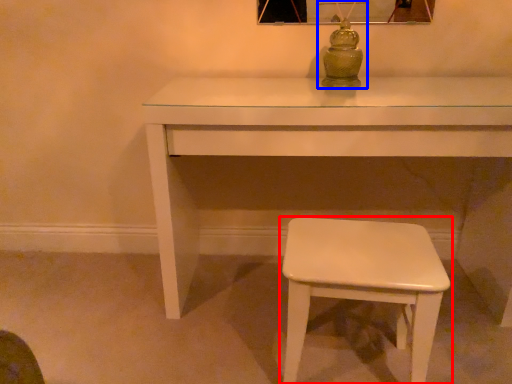
Question: Which object appears farthest to the camera in this image, stool (highlighted by a red box) or table lamp (highlighted by a blue box)?

Choices:
 (A) stool
 (B) table lamp

Answer: (B)